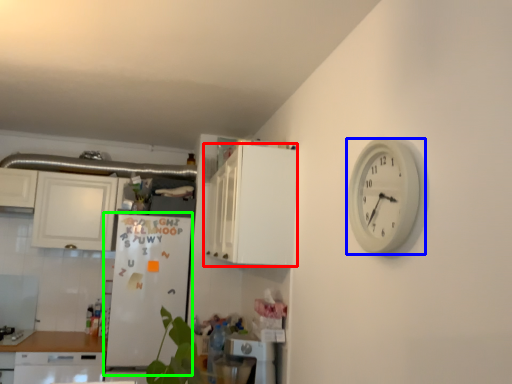
Question: Which is farther away from cabinetry (highlighted by a red box)? wall clock (highlighted by a blue box) or fridge (highlighted by a green box)?

Choices:
 (A) wall clock
 (B) fridge

Answer: (B)